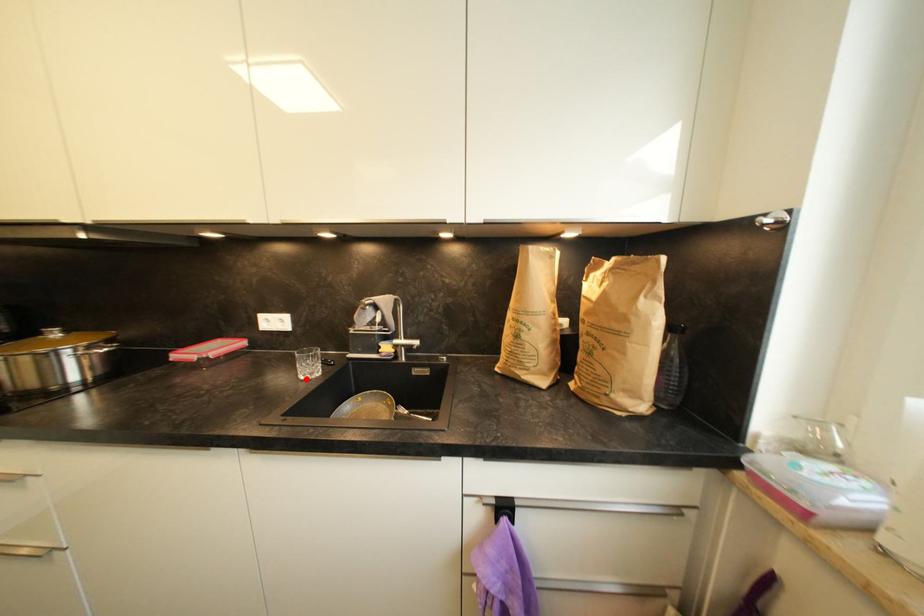
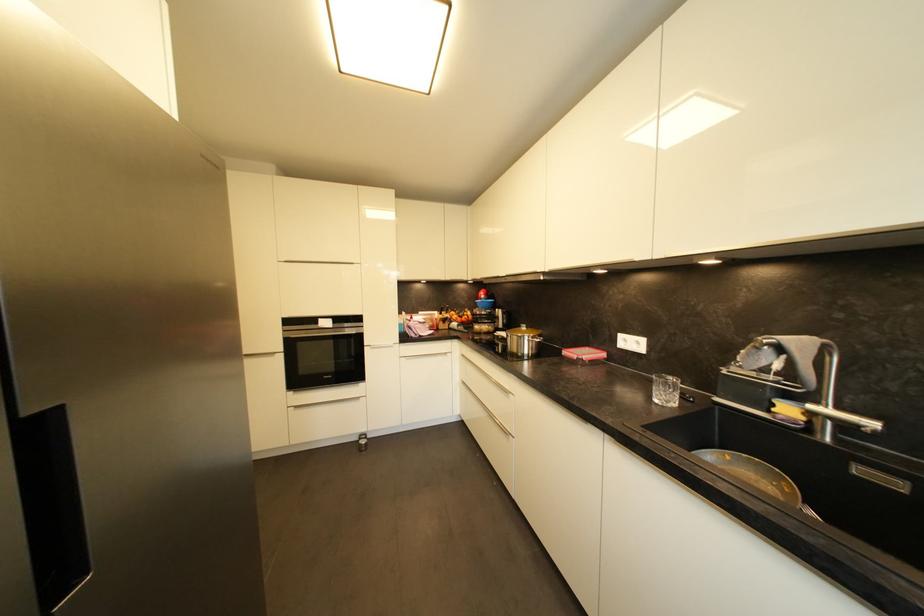
Question: A red point is marked in image1. In image2, is the corresponding 3D point closer to the camera or farther? Reply with the corresponding letter.

Choices:
 (A) The corresponding 3D point is closer.
 (B) The corresponding 3D point is farther.

Answer: (A)